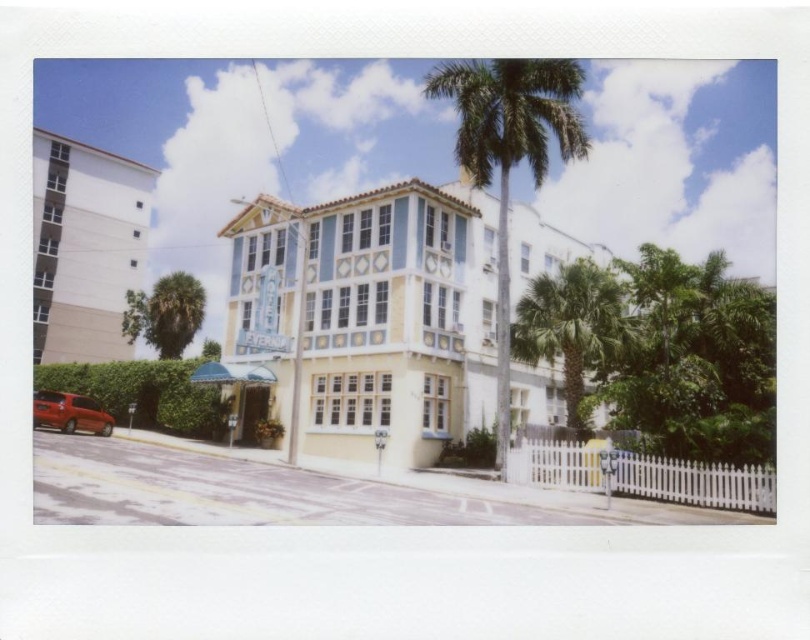
Based on the photo, between green leafy palm tree at center-right and shiny red car at lower left, which one is positioned lower?

Positioned lower is shiny red car at lower left.

Can you confirm if green leafy palm tree at center-right is wider than shiny red car at lower left?

Correct, the width of green leafy palm tree at center-right exceeds that of shiny red car at lower left.

Is point (548, 278) positioned after point (54, 412)?

That is False.

What are the coordinates of `green leafy palm tree at center-right` in the screenshot? It's located at (570, 326).

Who is higher up, green leafy palm tree at center or green leafy palm tree at lower left?

green leafy palm tree at center is above.

Is point (557, 132) farther from camera compared to point (162, 314)?

No, (557, 132) is closer to viewer.

Where is `green leafy palm tree at center`? Image resolution: width=810 pixels, height=640 pixels. green leafy palm tree at center is located at coordinates (509, 154).

Looking at this image, between green leafy palm tree at center and shiny red car at lower left, which one has less height?

shiny red car at lower left is shorter.

Does point (563, 81) come behind point (96, 422)?

No, (563, 81) is closer to viewer.

Where is `green leafy palm tree at center`? green leafy palm tree at center is located at coordinates (509, 154).